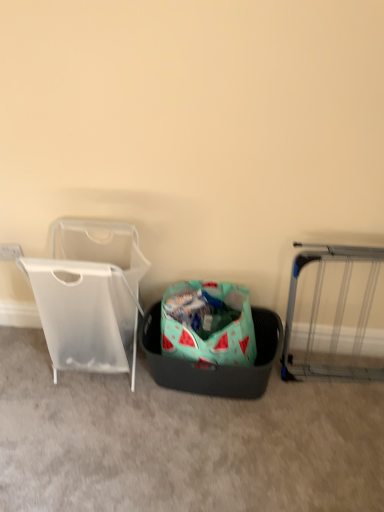
Question: From a real-world perspective, relative to transparent plastic laundry basket at left, is teal fabric laundry basket at center vertically above or below?

Choices:
 (A) above
 (B) below

Answer: (B)

Question: Considering the positions of point (254, 318) and point (79, 291), is point (254, 318) closer or farther from the camera than point (79, 291)?

Choices:
 (A) closer
 (B) farther

Answer: (B)

Question: Estimate the real-world distances between objects in this image. Which object is farther from the silver metallic gate at right?

Choices:
 (A) transparent plastic laundry basket at left
 (B) teal fabric laundry basket at center

Answer: (A)

Question: Estimate the real-world distances between objects in this image. Which object is closer to the silver metallic gate at right?

Choices:
 (A) transparent plastic laundry basket at left
 (B) teal fabric laundry basket at center

Answer: (B)